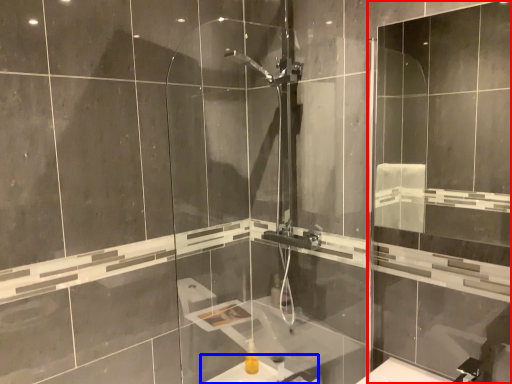
Question: Which of the following is the farthest to the observer, screen door (highlighted by a red box) or sink (highlighted by a blue box)?

Choices:
 (A) screen door
 (B) sink

Answer: (B)